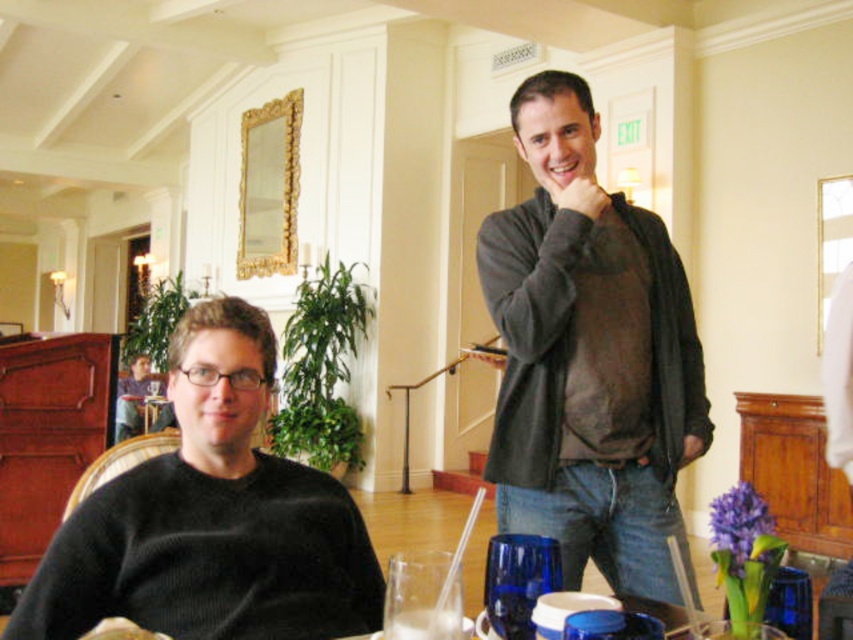
You are a photographer setting up a shot in this scene. You need to ensure that the black matte sweater at left does not block the white matte bread at lower left in the frame. Given their positions and sizes, is this arrangement feasible?

The black matte sweater at left might be wider than white matte bread at lower left, so there is a possibility that the sweater could block the bread in the frame. Adjust the camera angle or position to ensure both are visible without obstruction.

You are a photographer taking a closeup shot of the dark gray sweater at upper right and the white matte bread at lower left. Which object should you focus on first if you want to capture both in the same frame without moving the camera?

You should focus on the dark gray sweater at upper right first because it is larger than the white matte bread at lower left, allowing it to be the main subject while still fitting the smaller bread into the frame.

You are a photographer taking a picture of the scene. You want to ensure both the dark gray sweater at upper right and the white matte bread at lower left are clearly visible in the frame. Which object might appear larger in the photo due to its position and size?

The dark gray sweater at upper right appears larger in the photo because it has a greater height compared to the white matte bread at lower left.